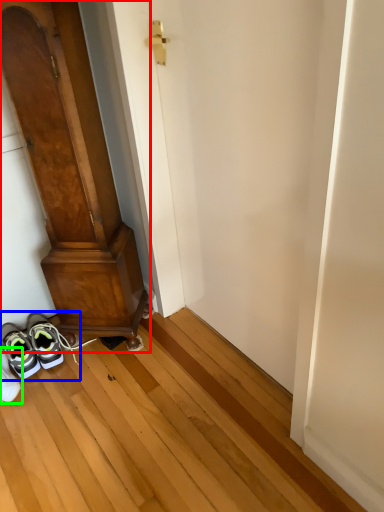
Question: Based on their relative distances, which object is farther from door (highlighted by a red box)? Choose from footwear (highlighted by a blue box) and footwear (highlighted by a green box).

Choices:
 (A) footwear
 (B) footwear

Answer: (B)